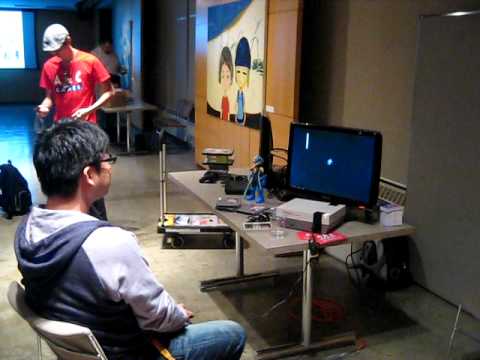
What are the coordinates of `wires` in the screenshot? It's located at (352, 261), (351, 253).